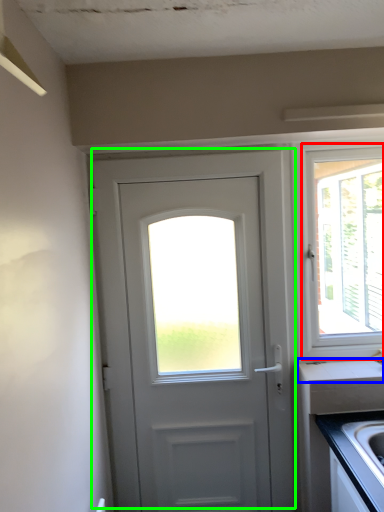
Question: Which object is the farthest from window (highlighted by a red box)? Choose among these: counter top (highlighted by a blue box) or door (highlighted by a green box).

Choices:
 (A) counter top
 (B) door

Answer: (B)